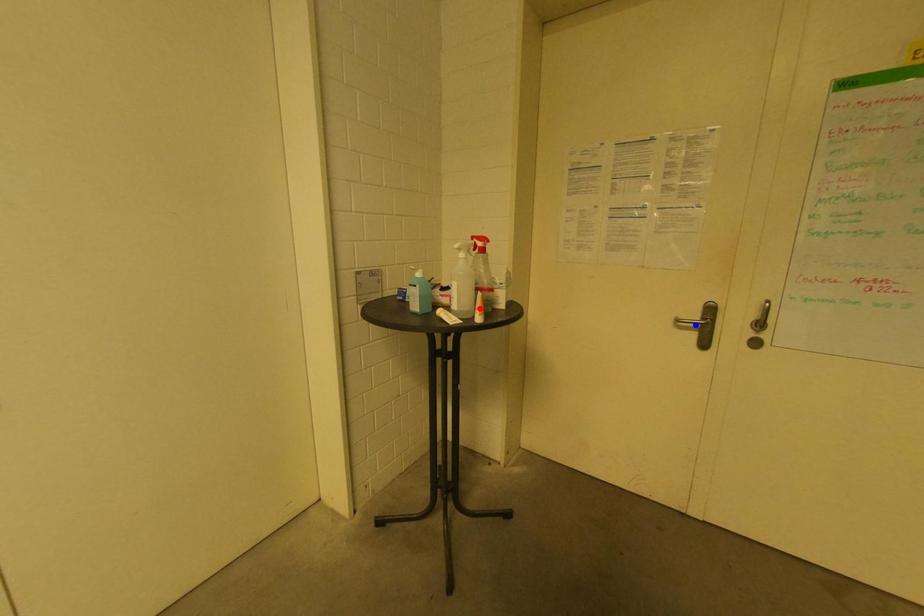
Question: Two points are marked on the image. Which point is closer to the camera?

Choices:
 (A) Blue point is closer.
 (B) Red point is closer.

Answer: (B)